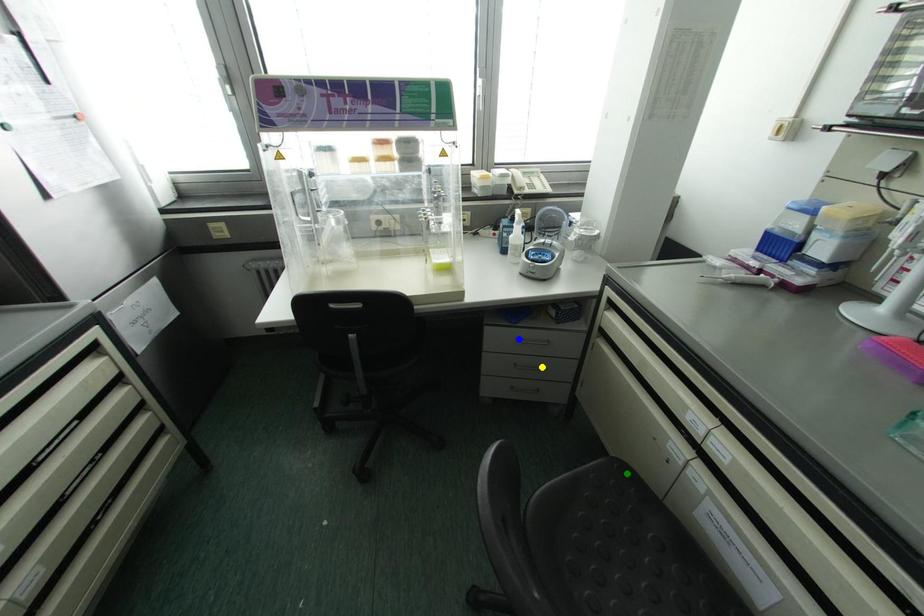
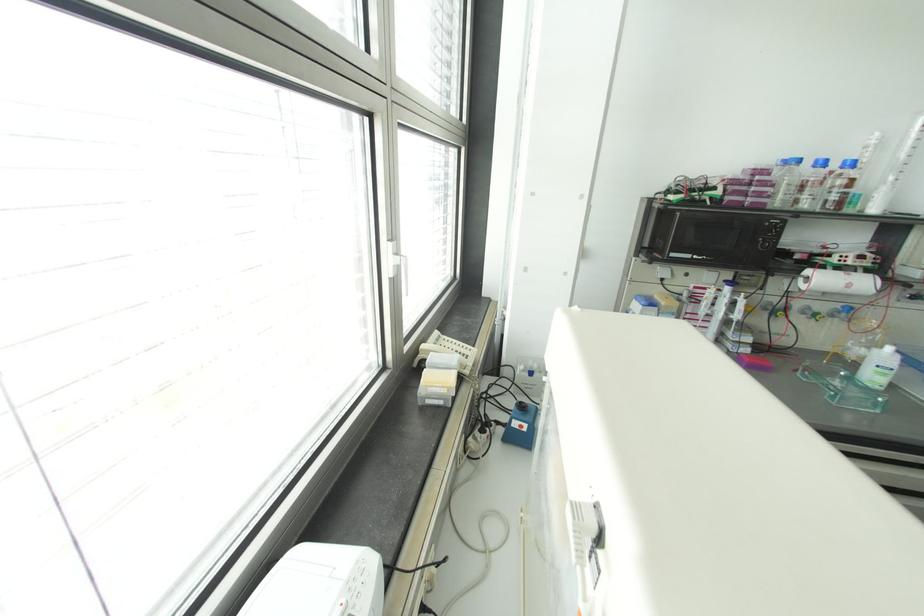
I am providing you with two images of the same scene from different viewpoints. Three points are marked in image1. Which point corresponds to a part or object that is occluded in image2?In image1, three points are marked. Which of them correspond to a part or object that is occluded in image2?Among the three points shown in image1, which one corresponds to a part or object that is no longer visible due to occlusion in image2?

green point, blue point, yellow point cannot be seen in image2.